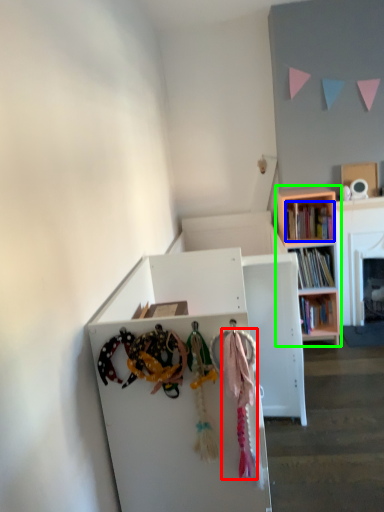
Question: Which is farther away from clothesline (highlighted by a red box)? book (highlighted by a blue box) or bookcase (highlighted by a green box)?

Choices:
 (A) book
 (B) bookcase

Answer: (B)